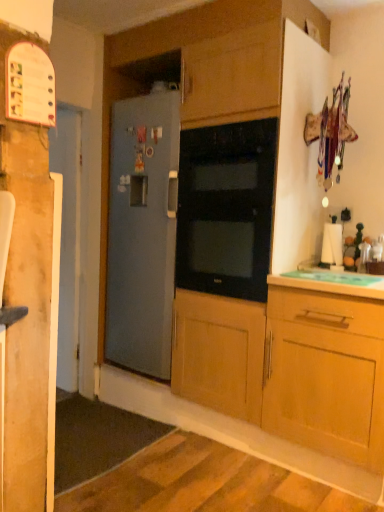
Question: Is black glass oven at center wider than green plastic cutting board at lower right?

Choices:
 (A) yes
 (B) no

Answer: (A)

Question: Is black glass oven at center next to green plastic cutting board at lower right?

Choices:
 (A) yes
 (B) no

Answer: (B)

Question: Is black glass oven at center not within green plastic cutting board at lower right?

Choices:
 (A) yes
 (B) no

Answer: (A)

Question: From the image's perspective, is black glass oven at center located beneath green plastic cutting board at lower right?

Choices:
 (A) no
 (B) yes

Answer: (A)

Question: Does black glass oven at center have a lesser width compared to green plastic cutting board at lower right?

Choices:
 (A) no
 (B) yes

Answer: (A)

Question: Which is correct: white glossy door at left is inside black glass oven at center, or outside of it?

Choices:
 (A) outside
 (B) inside

Answer: (A)

Question: Visually, is white glossy door at left positioned to the left or to the right of black glass oven at center?

Choices:
 (A) left
 (B) right

Answer: (A)

Question: Is white glossy door at left wider or thinner than black glass oven at center?

Choices:
 (A) wide
 (B) thin

Answer: (B)

Question: From a real-world perspective, is white glossy door at left physically located above or below black glass oven at center?

Choices:
 (A) below
 (B) above

Answer: (A)

Question: Considering the positions of black glass oven at center and white glossy door at left in the image, is black glass oven at center taller or shorter than white glossy door at left?

Choices:
 (A) short
 (B) tall

Answer: (A)

Question: From a real-world perspective, relative to white glossy door at left, is black glass oven at center vertically above or below?

Choices:
 (A) above
 (B) below

Answer: (A)

Question: Is black glass oven at center to the left or to the right of white glossy door at left in the image?

Choices:
 (A) right
 (B) left

Answer: (A)

Question: From the image's perspective, is black glass oven at center located above or below white glossy door at left?

Choices:
 (A) above
 (B) below

Answer: (A)

Question: From a real-world perspective, is satin gray refrigerator at center positioned above or below green plastic cutting board at lower right?

Choices:
 (A) below
 (B) above

Answer: (B)

Question: Is point (165, 94) closer or farther from the camera than point (382, 298)?

Choices:
 (A) farther
 (B) closer

Answer: (A)